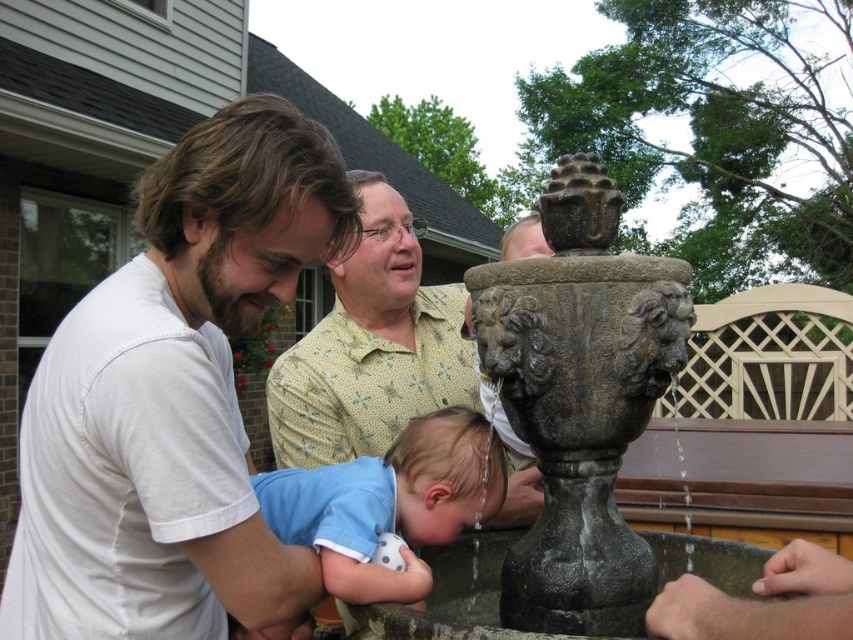
Can you confirm if blue cotton shirt at center is wider than smooth gray hand at lower right?

Correct, the width of blue cotton shirt at center exceeds that of smooth gray hand at lower right.

Between point (492, 492) and point (769, 588), which one is positioned in front?

Positioned in front is point (769, 588).

You are a GUI agent. You are given a task and a screenshot of the screen. Output one action in this format:
    pyautogui.click(x=<x>, y=<y>)
    Task: Click on the blue cotton shirt at center
    This screenshot has height=640, width=853.
    Given the screenshot: What is the action you would take?
    pyautogui.click(x=389, y=502)

Can you confirm if white cotton shirt at upper left is smaller than smooth gray hand at lower right?

No, white cotton shirt at upper left is not smaller than smooth gray hand at lower right.

Locate an element on the screen. The width and height of the screenshot is (853, 640). white cotton shirt at upper left is located at coordinates (173, 397).

Can you confirm if stone fountain at center is positioned to the left of smooth gray hand at lower right?

Yes, stone fountain at center is to the left of smooth gray hand at lower right.

Is the position of stone fountain at center less distant than that of smooth gray hand at lower right?

No.

Where is `stone fountain at center`? The height and width of the screenshot is (640, 853). stone fountain at center is located at coordinates (579, 401).